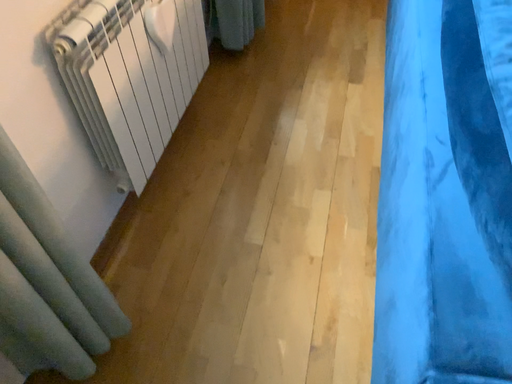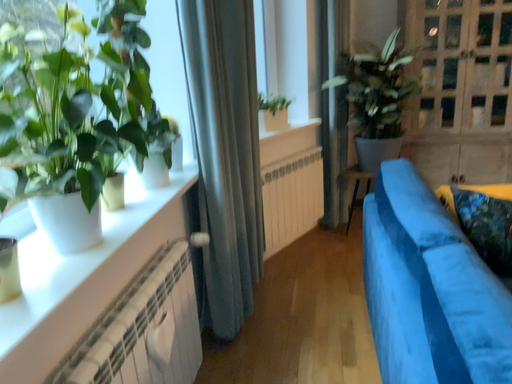
Question: How did the camera likely rotate when shooting the video?

Choices:
 (A) rotated upward
 (B) rotated downward

Answer: (A)